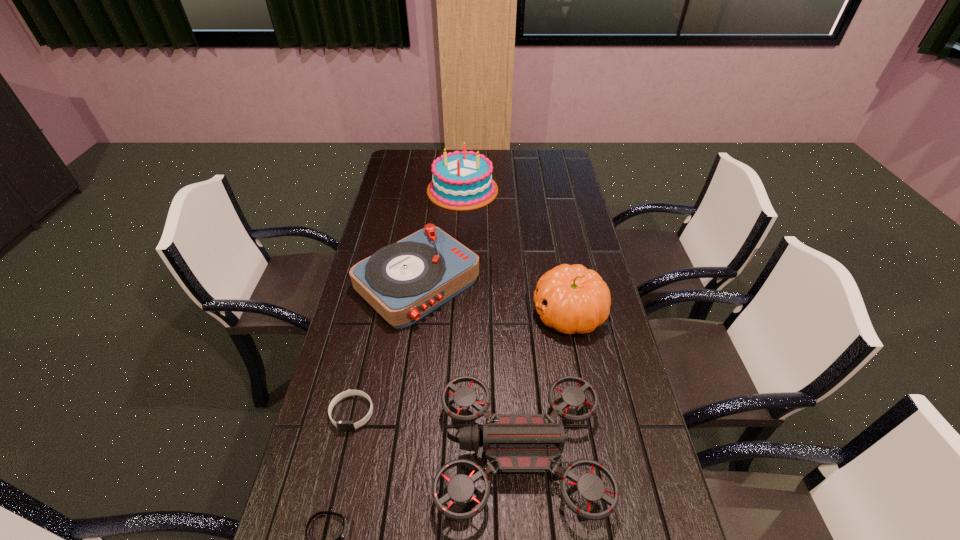
Find the location of a particular element. vacant space located 0.260m on the back of the record player is located at coordinates (429, 204).

You are a GUI agent. You are given a task and a screenshot of the screen. Output one action in this format:
    pyautogui.click(x=<x>, y=<y>)
    Task: Click on the vacant space located 0.130m on the front-facing side of the drone
    Image resolution: width=960 pixels, height=540 pixels.
    Given the screenshot: What is the action you would take?
    pyautogui.click(x=384, y=453)

In order to click on vacant region located on the front-facing side of the drone in this screenshot , I will do `click(380, 453)`.

Find the location of a particular element. This screenshot has width=960, height=540. vacant space situated on the front-facing side of the drone is located at coordinates (343, 453).

In order to click on vacant space located 0.120m on the outer surface of the second shortest object in this screenshot , I will do coord(337,481).

Where is `object that is at the far edge`? object that is at the far edge is located at coordinates (461, 181).

Identify the location of record player that is at the left edge. (404, 281).

Where is `wristband that is positioned at the left edge`? The width and height of the screenshot is (960, 540). wristband that is positioned at the left edge is located at coordinates (343, 426).

Identify the location of pumpkin present at the right edge. (572, 299).

The width and height of the screenshot is (960, 540). Identify the location of drone that is at the right edge. (515, 442).